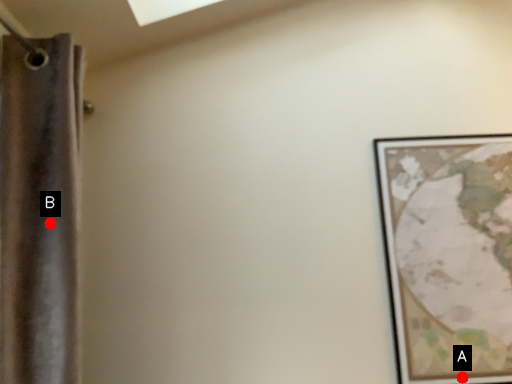
Question: Two points are circled on the image, labeled by A and B beside each circle. Which of the following is the farthest from the observer?

Choices:
 (A) A is further
 (B) B is further

Answer: (A)